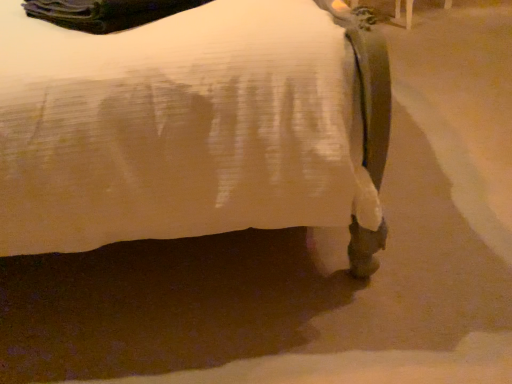
What is the approximate height of metallic silver bedpost at upper right?

metallic silver bedpost at upper right is 7.77 inches in height.

Find the location of a particular element. This screenshot has height=384, width=512. metallic silver bedpost at upper right is located at coordinates (408, 13).

Image resolution: width=512 pixels, height=384 pixels. Describe the element at coordinates (408, 13) in the screenshot. I see `metallic silver bedpost at upper right` at that location.

At what (x,y) coordinates should I click in order to perform the action: click on white matte bed at lower right. Please return your answer as a coordinate pair (x, y). The image size is (512, 384). Looking at the image, I should click on (194, 127).

What do you see at coordinates (194, 127) in the screenshot? I see `white matte bed at lower right` at bounding box center [194, 127].

Find the location of a particular element. The width and height of the screenshot is (512, 384). metallic silver bedpost at upper right is located at coordinates (408, 13).

Considering the positions of objects metallic silver bedpost at upper right and white matte bed at lower right in the image provided, who is more to the right, metallic silver bedpost at upper right or white matte bed at lower right?

From the viewer's perspective, metallic silver bedpost at upper right appears more on the right side.

Which is behind, metallic silver bedpost at upper right or white matte bed at lower right?

metallic silver bedpost at upper right is further from the camera.

Does point (409, 0) come farther from viewer compared to point (77, 100)?

Yes.

From the image's perspective, is metallic silver bedpost at upper right above white matte bed at lower right?

Yes, from the image's perspective, metallic silver bedpost at upper right is on top of white matte bed at lower right.

Based on the photo, from a real-world perspective, is metallic silver bedpost at upper right physically below white matte bed at lower right?

Yes, from a real-world perspective, metallic silver bedpost at upper right is below white matte bed at lower right.

Can you confirm if metallic silver bedpost at upper right is wider than white matte bed at lower right?

Incorrect, the width of metallic silver bedpost at upper right does not surpass that of white matte bed at lower right.

Between metallic silver bedpost at upper right and white matte bed at lower right, which one has more height?

white matte bed at lower right.

Is metallic silver bedpost at upper right bigger or smaller than white matte bed at lower right?

metallic silver bedpost at upper right is smaller than white matte bed at lower right.

Choose the correct answer: Is metallic silver bedpost at upper right inside white matte bed at lower right or outside it?

metallic silver bedpost at upper right is not inside white matte bed at lower right, it's outside.

Is metallic silver bedpost at upper right beside white matte bed at lower right?

No, metallic silver bedpost at upper right is not with white matte bed at lower right.

Is metallic silver bedpost at upper right oriented towards white matte bed at lower right?

No, metallic silver bedpost at upper right is not turned towards white matte bed at lower right.

How different are the orientations of metallic silver bedpost at upper right and white matte bed at lower right in degrees?

There is a 90.5-degree angle between the facing directions of metallic silver bedpost at upper right and white matte bed at lower right.

Image resolution: width=512 pixels, height=384 pixels. In order to click on furniture above the white matte bed at lower right (from the image's perspective) in this screenshot , I will do `click(408, 13)`.

Visually, is white matte bed at lower right positioned to the left or to the right of metallic silver bedpost at upper right?

white matte bed at lower right is to the left of metallic silver bedpost at upper right.

Between white matte bed at lower right and metallic silver bedpost at upper right, which one is positioned in front?

white matte bed at lower right.

Which is nearer, (328, 162) or (408, 12)?

Point (328, 162) is positioned closer to the camera compared to point (408, 12).

From the image's perspective, is white matte bed at lower right over metallic silver bedpost at upper right?

No, from the image's perspective, white matte bed at lower right is not on top of metallic silver bedpost at upper right.

From a real-world perspective, does white matte bed at lower right stand above metallic silver bedpost at upper right?

Indeed, from a real-world perspective, white matte bed at lower right stands above metallic silver bedpost at upper right.

Which of these two, white matte bed at lower right or metallic silver bedpost at upper right, is thinner?

With smaller width is metallic silver bedpost at upper right.

Which of these two, white matte bed at lower right or metallic silver bedpost at upper right, stands shorter?

metallic silver bedpost at upper right.

Based on their sizes in the image, would you say white matte bed at lower right is bigger or smaller than metallic silver bedpost at upper right?

white matte bed at lower right is bigger than metallic silver bedpost at upper right.

Which is correct: white matte bed at lower right is inside metallic silver bedpost at upper right, or outside of it?

white matte bed at lower right is not inside metallic silver bedpost at upper right, it's outside.

Is white matte bed at lower right in contact with metallic silver bedpost at upper right?

There is a gap between white matte bed at lower right and metallic silver bedpost at upper right.

Is white matte bed at lower right positioned with its back to metallic silver bedpost at upper right?

That's not correct — white matte bed at lower right is not looking away from metallic silver bedpost at upper right.

What's the angular difference between white matte bed at lower right and metallic silver bedpost at upper right's facing directions?

The angle between the facing direction of white matte bed at lower right and the facing direction of metallic silver bedpost at upper right is 90.5 degrees.

Measure the distance from white matte bed at lower right to metallic silver bedpost at upper right.

white matte bed at lower right and metallic silver bedpost at upper right are 7.54 feet apart from each other.

This screenshot has height=384, width=512. I want to click on bed located above the metallic silver bedpost at upper right (from a real-world perspective), so click(x=194, y=127).

This screenshot has width=512, height=384. I want to click on furniture below the white matte bed at lower right (from a real-world perspective), so click(x=408, y=13).

Where is `furniture above the white matte bed at lower right (from the image's perspective)`? This screenshot has width=512, height=384. furniture above the white matte bed at lower right (from the image's perspective) is located at coordinates (408, 13).